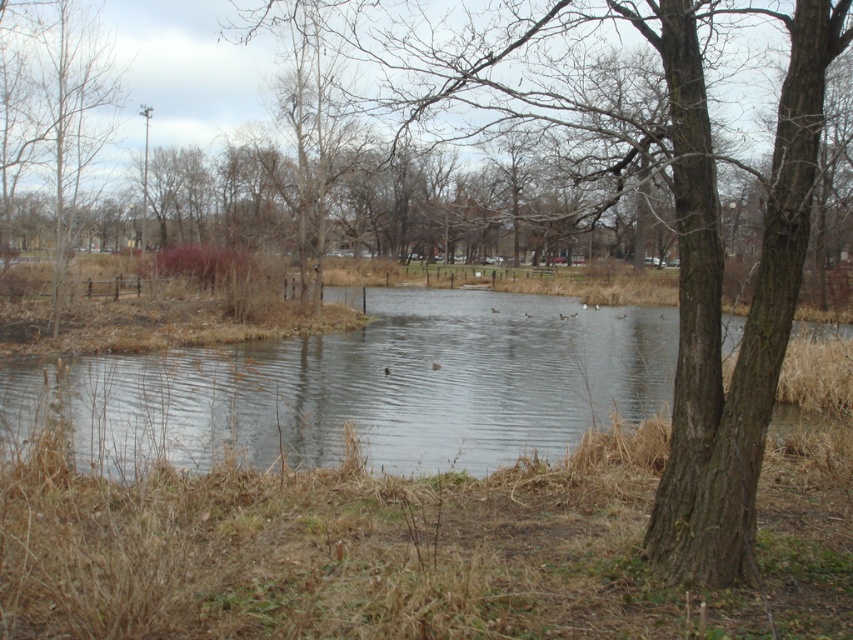
Question: Which point appears farthest from the camera in this image?

Choices:
 (A) (78, 65)
 (B) (670, 497)

Answer: (A)

Question: From the image, what is the correct spatial relationship of brown rough tree at center in relation to brown bark tree at upper left?

Choices:
 (A) left
 (B) right

Answer: (B)

Question: Observing the image, what is the correct spatial positioning of brown rough tree at center in reference to brown bark tree at upper left?

Choices:
 (A) below
 (B) above

Answer: (A)

Question: Is brown rough tree at center smaller than brown bark tree at upper left?

Choices:
 (A) yes
 (B) no

Answer: (A)

Question: Which of the following is the farthest from the observer?

Choices:
 (A) (751, 376)
 (B) (57, 35)

Answer: (B)